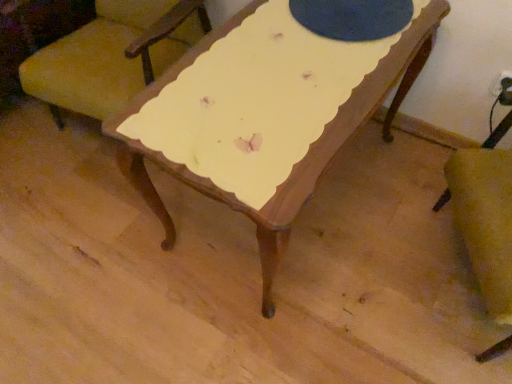
Question: Considering the relative positions of yellow fabric chair at upper left, the 1th chair in the left-to-right sequence, and velvet yellow armchair at lower right, which is the 1th chair from right to left, in the image provided, is yellow fabric chair at upper left, the 1th chair in the left-to-right sequence, to the left or to the right of velvet yellow armchair at lower right, which is the 1th chair from right to left,?

Choices:
 (A) left
 (B) right

Answer: (A)

Question: From a real-world perspective, relative to velvet yellow armchair at lower right, which is the 1th chair from right to left, is yellow fabric chair at upper left, the 1th chair in the left-to-right sequence, vertically above or below?

Choices:
 (A) above
 (B) below

Answer: (A)

Question: In terms of width, does yellow fabric chair at upper left, the second chair in the right-to-left sequence, look wider or thinner when compared to velvet yellow armchair at lower right, which is the 1th chair from right to left?

Choices:
 (A) thin
 (B) wide

Answer: (B)

Question: From a real-world perspective, is velvet yellow armchair at lower right, which is the 2th chair in left-to-right order, physically located above or below yellow fabric chair at upper left, the 1th chair in the left-to-right sequence?

Choices:
 (A) above
 (B) below

Answer: (B)

Question: Is velvet yellow armchair at lower right, which is the 1th chair from right to left, bigger or smaller than yellow fabric chair at upper left, the second chair in the right-to-left sequence?

Choices:
 (A) big
 (B) small

Answer: (B)

Question: Relative to yellow fabric chair at upper left, the 1th chair in the left-to-right sequence, is velvet yellow armchair at lower right, which is the 2th chair in left-to-right order, in front or behind?

Choices:
 (A) behind
 (B) front

Answer: (B)

Question: In terms of height, does velvet yellow armchair at lower right, which is the 1th chair from right to left, look taller or shorter compared to yellow fabric chair at upper left, the 1th chair in the left-to-right sequence?

Choices:
 (A) tall
 (B) short

Answer: (A)